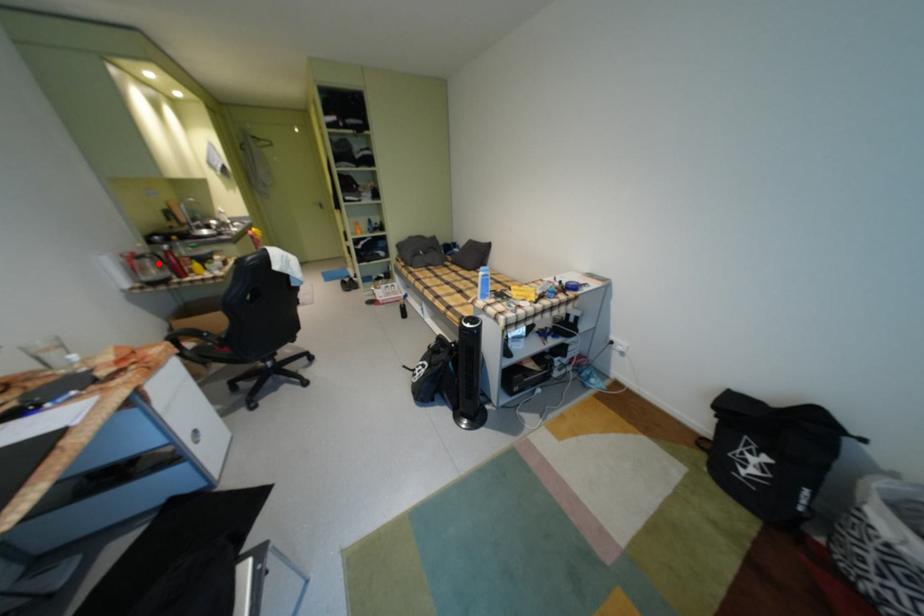
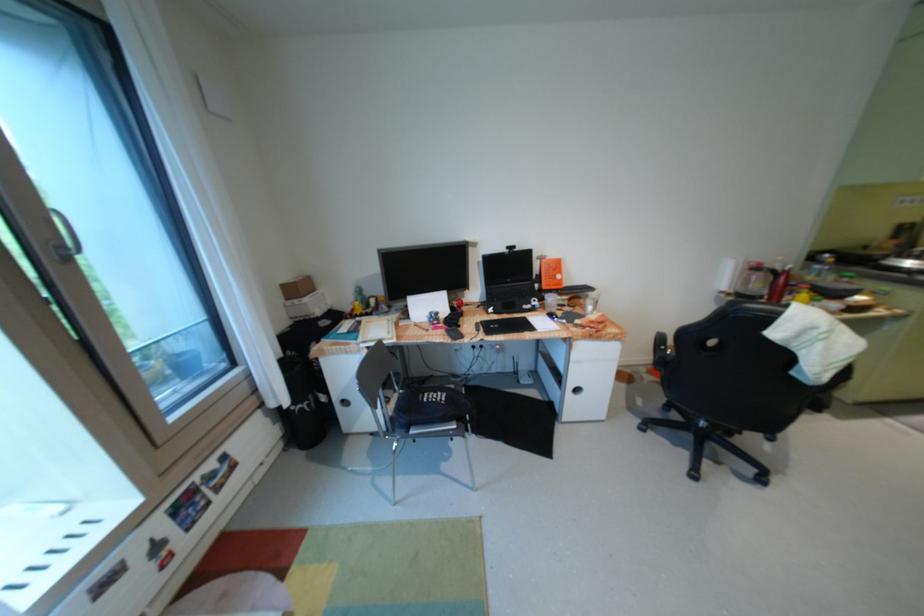
Find the pixel in the second image that matches the highlighted location in the first image.

(768, 277)